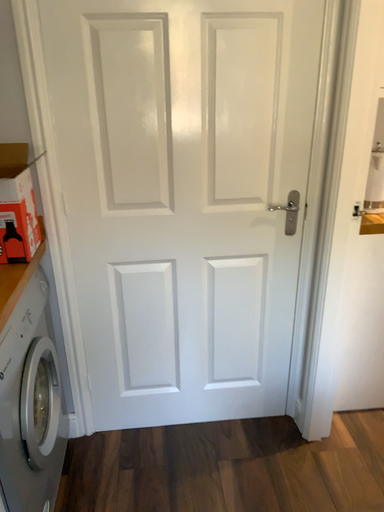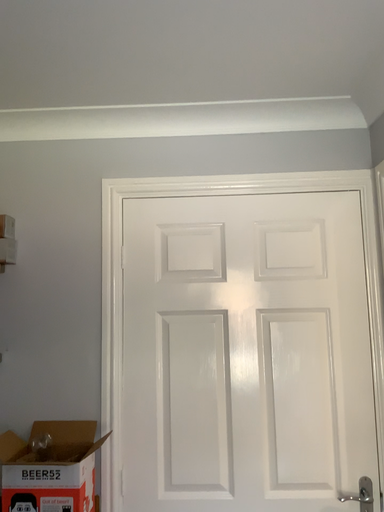
Question: How did the camera likely rotate when shooting the video?

Choices:
 (A) rotated downward
 (B) rotated upward

Answer: (B)